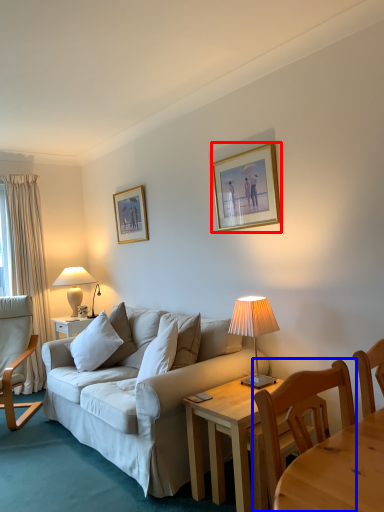
Question: Which object appears farthest to the camera in this image, picture frame (highlighted by a red box) or chair (highlighted by a blue box)?

Choices:
 (A) picture frame
 (B) chair

Answer: (A)